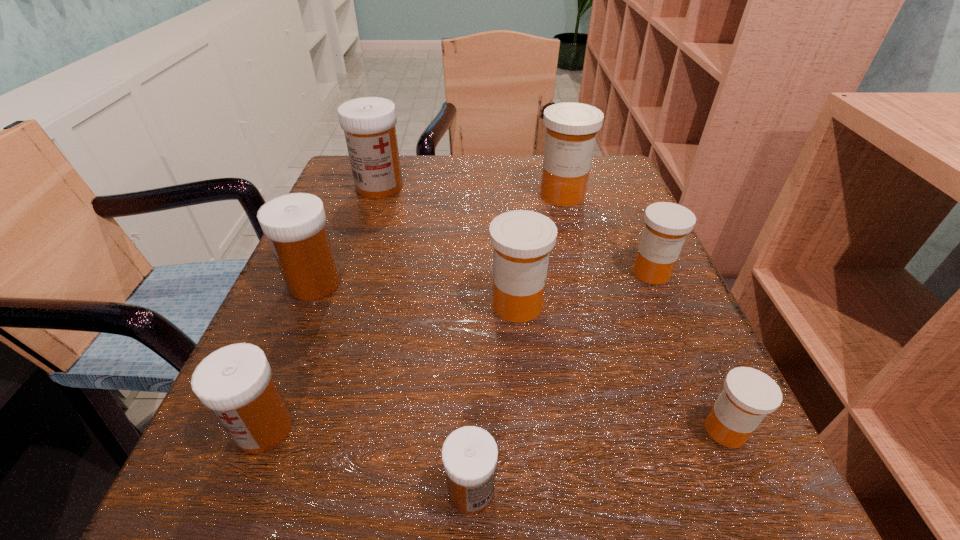
You are a GUI agent. You are given a task and a screenshot of the screen. Output one action in this format:
    pyautogui.click(x=<x>, y=<y>)
    Task: Click on the vacant space located on the label of the smallest orange medicine
    The width and height of the screenshot is (960, 540).
    Given the screenshot: What is the action you would take?
    pyautogui.click(x=390, y=430)

The image size is (960, 540). I want to click on free space located on the back of the nearest object, so click(x=474, y=256).

Identify the location of object situated at the near edge. This screenshot has height=540, width=960. (469, 454).

Locate an element on the screen. This screenshot has width=960, height=540. object present at the far left corner is located at coordinates (369, 123).

Where is `object positioned at the far right corner`? The image size is (960, 540). object positioned at the far right corner is located at coordinates (571, 131).

Image resolution: width=960 pixels, height=540 pixels. In order to click on free region at the far edge in this screenshot , I will do `click(486, 161)`.

Identify the location of vacant space at the near edge of the desktop. The image size is (960, 540). (327, 508).

Identify the location of free space at the left edge. (x=320, y=460).

The height and width of the screenshot is (540, 960). I want to click on free space at the right edge, so click(x=597, y=229).

In the image, there is a desktop. Find the location of `free space at the near left corner`. free space at the near left corner is located at coordinates (296, 484).